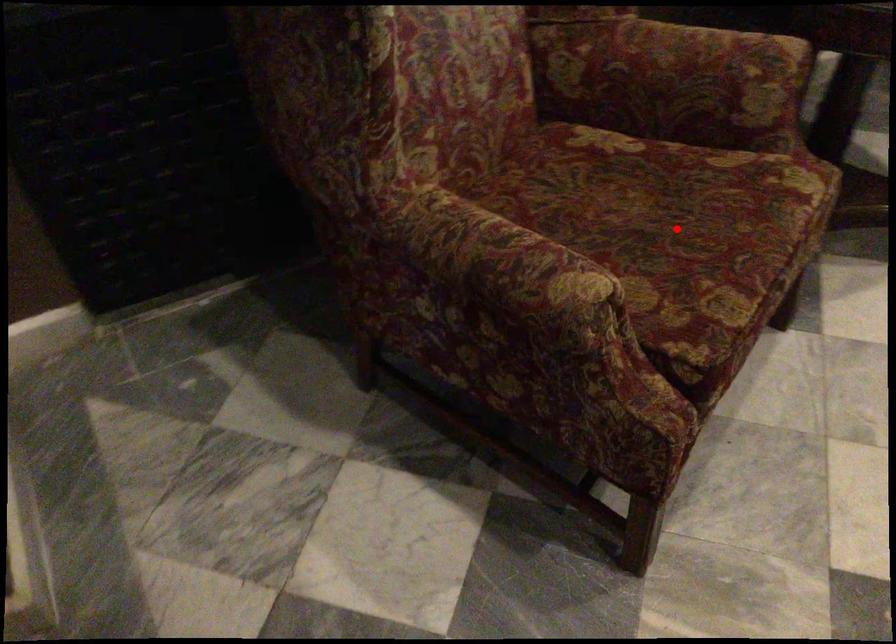
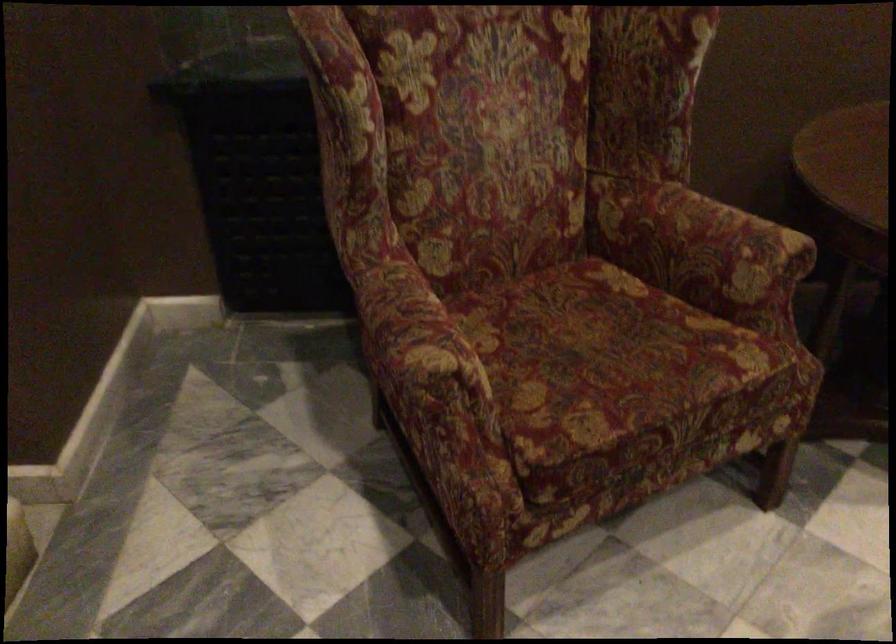
Question: I am providing you with two images of the same scene from different viewpoints. Given a red point in image1, look at the same physical point in image2. Is it:

Choices:
 (A) Closer to the viewpoint
 (B) Farther from the viewpoint

Answer: (B)